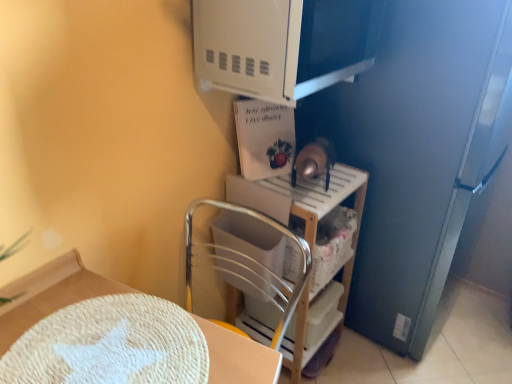
Question: From the image's perspective, is wooden shelf at center above or below white woven placemat at lower left?

Choices:
 (A) below
 (B) above

Answer: (B)

Question: Is wooden shelf at center spatially inside white woven placemat at lower left, or outside of it?

Choices:
 (A) inside
 (B) outside

Answer: (B)

Question: Based on their relative distances, which object is nearer to the white matte microwave at upper center?

Choices:
 (A) white woven placemat at lower left
 (B) wooden shelf at center

Answer: (B)

Question: Considering the real-world distances, which object is farthest from the white matte microwave at upper center?

Choices:
 (A) white woven placemat at lower left
 (B) wooden shelf at center

Answer: (A)